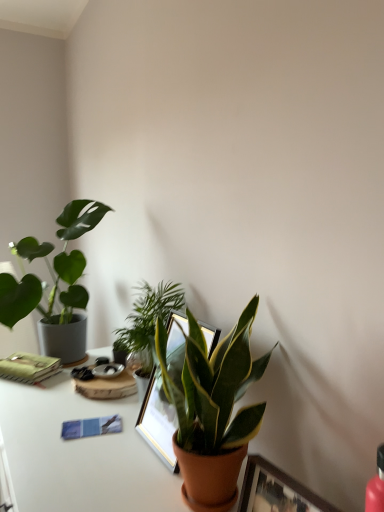
Question: Should I look upward or downward to see green matte plant at left, the 1th houseplant in the back-to-front sequence?

Choices:
 (A) up
 (B) down

Answer: (B)

Question: Can you confirm if green matte plant at center, marked as the third houseplant in a left-to-right arrangement, is bigger than green glossy plant at center, the 2th houseplant from the front?

Choices:
 (A) no
 (B) yes

Answer: (B)

Question: Is green matte plant at center, the 1th houseplant positioned from the front, to the left of green glossy plant at center, acting as the second houseplant starting from the right, from the viewer's perspective?

Choices:
 (A) no
 (B) yes

Answer: (A)

Question: Considering the relative sizes of green matte plant at center, marked as the third houseplant in a left-to-right arrangement, and green glossy plant at center, the 2th houseplant when ordered from back to front, in the image provided, is green matte plant at center, marked as the third houseplant in a left-to-right arrangement, shorter than green glossy plant at center, the 2th houseplant when ordered from back to front,?

Choices:
 (A) yes
 (B) no

Answer: (B)

Question: Is green matte plant at center, placed as the 1th houseplant when sorted from right to left, positioned with its back to green glossy plant at center, marked as the second houseplant in a left-to-right arrangement?

Choices:
 (A) yes
 (B) no

Answer: (B)

Question: Is green matte plant at center, which ranks as the third houseplant in back-to-front order, next to green glossy plant at center, acting as the second houseplant starting from the right?

Choices:
 (A) no
 (B) yes

Answer: (A)

Question: Does green matte plant at center, placed as the 1th houseplant when sorted from right to left, have a lesser width compared to green glossy plant at center, marked as the second houseplant in a left-to-right arrangement?

Choices:
 (A) no
 (B) yes

Answer: (A)

Question: From a real-world perspective, is green matte plant at center, placed as the 1th houseplant when sorted from right to left, on white glossy table at lower center?

Choices:
 (A) yes
 (B) no

Answer: (A)

Question: Is green matte plant at center, which ranks as the third houseplant in back-to-front order, looking in the opposite direction of white glossy table at lower center?

Choices:
 (A) yes
 (B) no

Answer: (B)

Question: From a real-world perspective, does green matte plant at center, the 1th houseplant positioned from the front, sit lower than white glossy table at lower center?

Choices:
 (A) yes
 (B) no

Answer: (B)

Question: Does green matte plant at center, which ranks as the third houseplant in back-to-front order, have a greater width compared to white glossy table at lower center?

Choices:
 (A) no
 (B) yes

Answer: (A)

Question: Would you say green matte plant at center, marked as the third houseplant in a left-to-right arrangement, contains white glossy table at lower center?

Choices:
 (A) no
 (B) yes

Answer: (A)

Question: Is green matte plant at center, marked as the third houseplant in a left-to-right arrangement, next to white glossy table at lower center and touching it?

Choices:
 (A) no
 (B) yes

Answer: (A)

Question: Considering the relative sizes of green glossy plant at center, marked as the second houseplant in a left-to-right arrangement, and green matte plant at center, marked as the third houseplant in a left-to-right arrangement, in the image provided, is green glossy plant at center, marked as the second houseplant in a left-to-right arrangement, bigger than green matte plant at center, marked as the third houseplant in a left-to-right arrangement,?

Choices:
 (A) no
 (B) yes

Answer: (A)